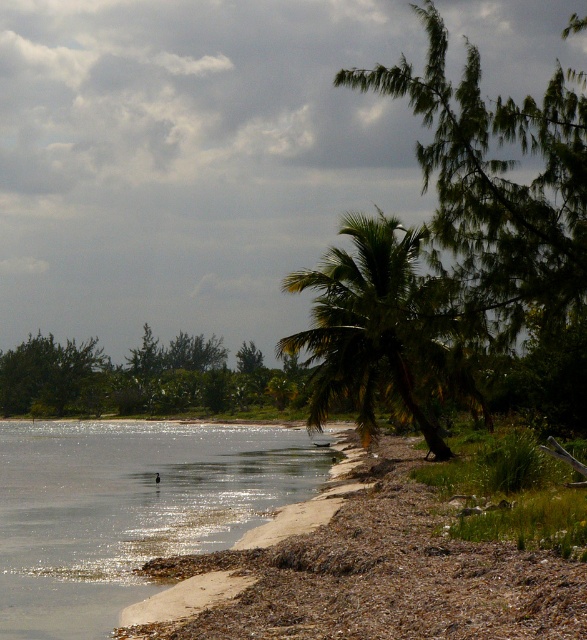
You are standing on the beach and see the clear water at lower left and the green leafy tree at center. Which object is positioned more to the right side of the scene?

The clear water at lower left is positioned more to the right side of the scene compared to the green leafy tree at center.

You are standing on the beach and want to walk towards the green leafy palm tree at center. Which direction should you move relative to the clear water at lower left?

You should move away from the clear water at lower left because the green leafy palm tree at center is further away from you than the clear water at lower left.

You are standing on the beach and want to take a photo that includes both the clear water at lower left and the green leafy tree at center. Which object should you zoom in on to ensure both fit in the frame?

The clear water at lower left is smaller than the green leafy tree at center, so you should zoom in on the green leafy tree at center to ensure both fit in the frame.